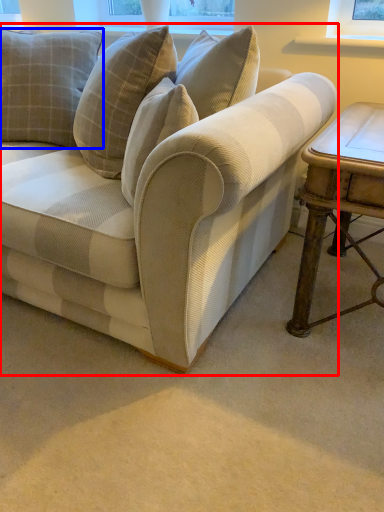
Question: Which object is further to the camera taking this photo, studio couch (highlighted by a red box) or pillow (highlighted by a blue box)?

Choices:
 (A) studio couch
 (B) pillow

Answer: (B)